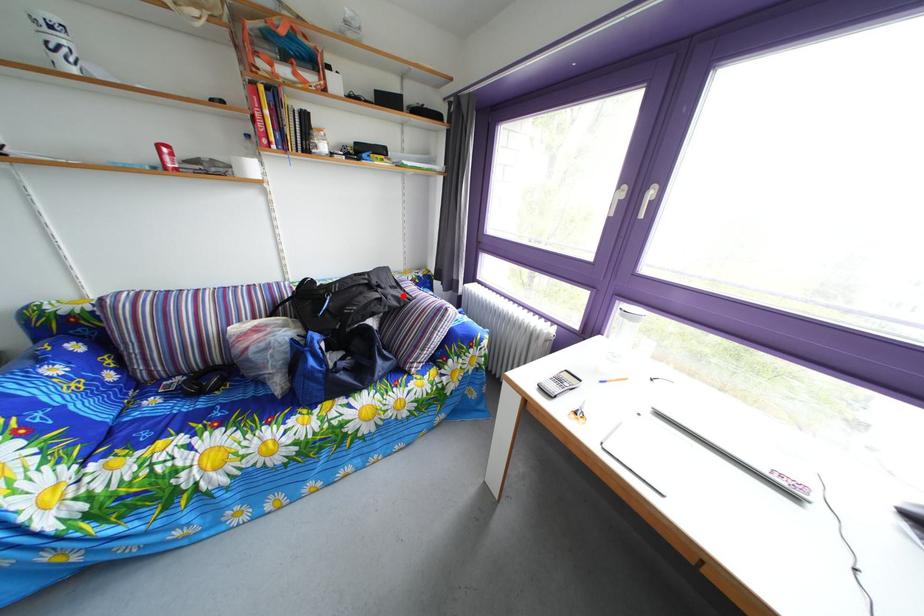
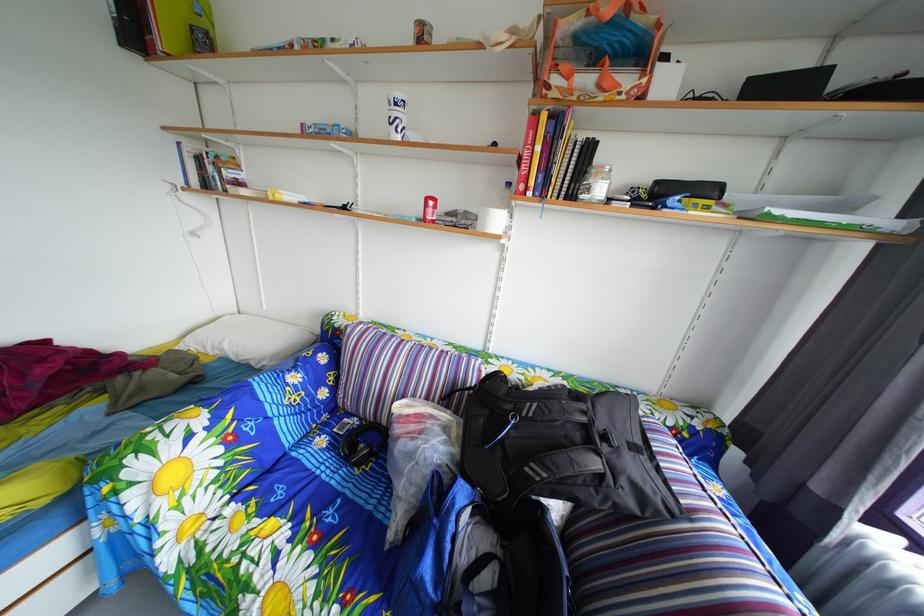
In the second image, find the point that corresponds to the highlighted location in the first image.

(643, 456)